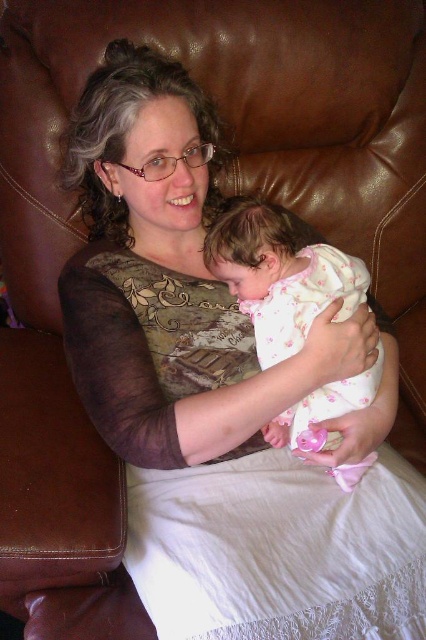
Between matte brown dress at center and white floral fabric baby at center, which one appears on the left side from the viewer's perspective?

Positioned to the left is matte brown dress at center.

Between point (172, 323) and point (279, 422), which one is positioned in front?

Point (279, 422)

At what (x,y) coordinates should I click in order to perform the action: click on matte brown dress at center. Please return your answer as a coordinate pair (x, y). This screenshot has height=640, width=426. Looking at the image, I should click on (169, 280).